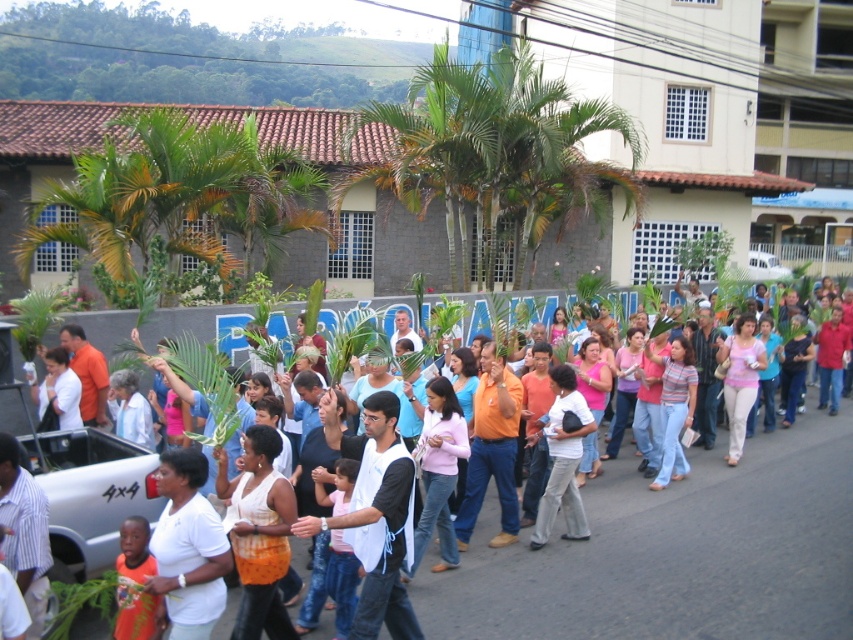
Question: Which of the following is the closest to the observer?

Choices:
 (A) (428, 170)
 (B) (474, 488)
 (C) (148, 532)

Answer: (C)

Question: Does green leafy palm tree at center have a larger size compared to striped cotton shirt at center?

Choices:
 (A) yes
 (B) no

Answer: (A)

Question: Can you confirm if orange cotton shirt at center is positioned above striped cotton shirt at center?

Choices:
 (A) yes
 (B) no

Answer: (B)

Question: Which of these objects is positioned closest to the white matte shirt at center?

Choices:
 (A) white cotton shirt at center
 (B) orange cotton shirt at lower left

Answer: (B)

Question: Is striped cotton shirt at center wider than orange cotton shirt at lower left?

Choices:
 (A) no
 (B) yes

Answer: (B)

Question: Which is nearer to the white matte shirt at center?

Choices:
 (A) striped cotton shirt at center
 (B) orange cotton shirt at lower left

Answer: (B)